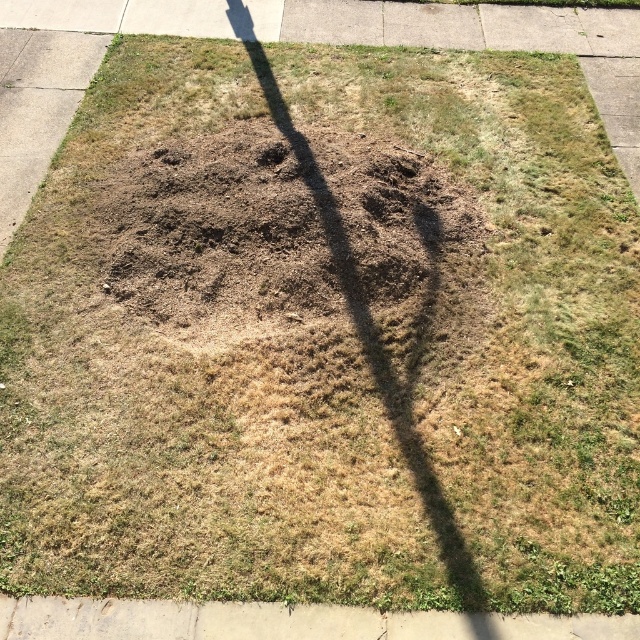
Does gray concrete curb at lower left have a smaller size compared to dirt/soil at center?

Actually, gray concrete curb at lower left might be larger than dirt/soil at center.

In the scene shown: Can you confirm if gray concrete curb at lower left is taller than dirt/soil at center?

No.

Does point (230, 609) come farther from viewer compared to point (268, 154)?

No, (230, 609) is closer to viewer.

This screenshot has width=640, height=640. Identify the location of gray concrete curb at lower left. click(282, 621).